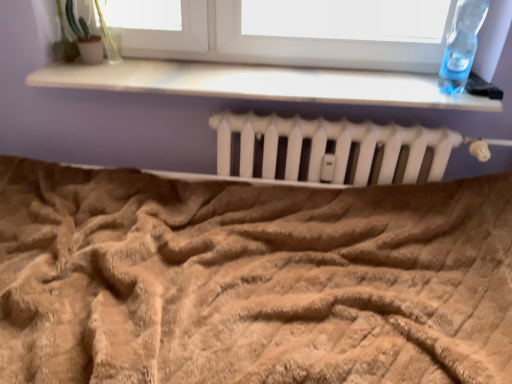
The width and height of the screenshot is (512, 384). What do you see at coordinates (331, 150) in the screenshot?
I see `white matte radiator at center` at bounding box center [331, 150].

Locate an element on the screen. The width and height of the screenshot is (512, 384). green matte plant at upper left is located at coordinates (79, 37).

At what (x,y) coordinates should I click in order to perform the action: click on beige textured blanket at center. Please return your answer as a coordinate pair (x, y). This screenshot has height=384, width=512. Looking at the image, I should click on (251, 280).

Is green matte plant at upper left oriented towards transparent plastic bottle at upper right?

No, green matte plant at upper left is not oriented towards transparent plastic bottle at upper right.

Consider the image. Is green matte plant at upper left placed right next to transparent plastic bottle at upper right?

There is a gap between green matte plant at upper left and transparent plastic bottle at upper right.

Is green matte plant at upper left wider than transparent plastic bottle at upper right?

In fact, green matte plant at upper left might be narrower than transparent plastic bottle at upper right.

Is green matte plant at upper left inside or outside of transparent plastic bottle at upper right?

green matte plant at upper left is not inside transparent plastic bottle at upper right, it's outside.

Which object is further away from the camera, transparent plastic bottle at upper right or white matte radiator at center?

white matte radiator at center is further away from the camera.

Is transparent plastic bottle at upper right taller than white matte radiator at center?

In fact, transparent plastic bottle at upper right may be shorter than white matte radiator at center.

In terms of size, does transparent plastic bottle at upper right appear bigger or smaller than white matte radiator at center?

Considering their sizes, transparent plastic bottle at upper right takes up less space than white matte radiator at center.

Can you confirm if transparent plastic bottle at upper right is smaller than beige textured blanket at center?

Yes.

Can you confirm if transparent plastic bottle at upper right is shorter than beige textured blanket at center?

No.

Is transparent plastic bottle at upper right next to beige textured blanket at center and touching it?

transparent plastic bottle at upper right and beige textured blanket at center are not in contact.

Is point (484, 18) closer or farther from the camera than point (377, 352)?

Point (484, 18) is positioned farther from the camera compared to point (377, 352).

Consider the image. Is transparent plastic bottle at upper right next to green matte plant at upper left?

transparent plastic bottle at upper right and green matte plant at upper left are clearly separated.

Is point (459, 34) farther from viewer compared to point (84, 23)?

Yes, it is.

Would you say transparent plastic bottle at upper right is outside green matte plant at upper left?

Absolutely, transparent plastic bottle at upper right is external to green matte plant at upper left.

From a real-world perspective, is transparent plastic bottle at upper right below green matte plant at upper left?

Yes, from a real-world perspective, transparent plastic bottle at upper right is beneath green matte plant at upper left.

Is beige textured blanket at center to the left of white matte radiator at center from the viewer's perspective?

Yes.

Is beige textured blanket at center completely or partially outside of white matte radiator at center?

Indeed, beige textured blanket at center is completely outside white matte radiator at center.

Is beige textured blanket at center shorter than white matte radiator at center?

Yes.

Which of these two, white matte radiator at center or beige textured blanket at center, stands taller?

white matte radiator at center is taller.

Is white matte radiator at center looking in the opposite direction of beige textured blanket at center?

white matte radiator at center is not turned away from beige textured blanket at center.

Is white matte radiator at center behind beige textured blanket at center?

Yes, white matte radiator at center is behind beige textured blanket at center.

Considering the positions of point (382, 137) and point (345, 229), is point (382, 137) closer or farther from the camera than point (345, 229)?

Point (382, 137).

Is beige textured blanket at center taller than green matte plant at upper left?

No.

Considering the relative positions of beige textured blanket at center and green matte plant at upper left in the image provided, is beige textured blanket at center in front of green matte plant at upper left?

Yes, the depth of beige textured blanket at center is less than that of green matte plant at upper left.

How distant is beige textured blanket at center from green matte plant at upper left?

The distance of beige textured blanket at center from green matte plant at upper left is 35.69 inches.

From the image's perspective, does beige textured blanket at center appear lower than green matte plant at upper left?

Yes, from the image's perspective, beige textured blanket at center is beneath green matte plant at upper left.

At what (x,y) coordinates should I click in order to perform the action: click on plant on the left of transparent plastic bottle at upper right. Please return your answer as a coordinate pair (x, y). The image size is (512, 384). Looking at the image, I should click on (79, 37).

Locate an element on the screen. radiator directly beneath the transparent plastic bottle at upper right (from a real-world perspective) is located at coordinates (331, 150).

Which object lies nearer to the anchor point beige textured blanket at center, transparent plastic bottle at upper right or green matte plant at upper left?

The object closer to beige textured blanket at center is transparent plastic bottle at upper right.

From the image, which object appears to be farther from white matte radiator at center, green matte plant at upper left or beige textured blanket at center?

Based on the image, green matte plant at upper left appears to be further to white matte radiator at center.

From the image, which object appears to be farther from white matte radiator at center, beige textured blanket at center or transparent plastic bottle at upper right?

transparent plastic bottle at upper right lies further to white matte radiator at center than the other object.

Considering their positions, is green matte plant at upper left positioned closer to transparent plastic bottle at upper right than white matte radiator at center?

The object closer to transparent plastic bottle at upper right is white matte radiator at center.

When comparing their distances from green matte plant at upper left, does white matte radiator at center or transparent plastic bottle at upper right seem closer?

white matte radiator at center lies closer to green matte plant at upper left than the other object.

When comparing their distances from white matte radiator at center, does beige textured blanket at center or green matte plant at upper left seem closer?

beige textured blanket at center lies closer to white matte radiator at center than the other object.

Based on their spatial positions, is beige textured blanket at center or white matte radiator at center closer to green matte plant at upper left?

white matte radiator at center is closer to green matte plant at upper left.

Estimate the real-world distances between objects in this image. Which object is closer to white matte radiator at center, transparent plastic bottle at upper right or beige textured blanket at center?

beige textured blanket at center is closer to white matte radiator at center.

Find the location of a particular element. bed between green matte plant at upper left and transparent plastic bottle at upper right in the horizontal direction is located at coordinates (251, 280).

At what (x,y) coordinates should I click in order to perform the action: click on radiator located between beige textured blanket at center and transparent plastic bottle at upper right in the left-right direction. Please return your answer as a coordinate pair (x, y). This screenshot has height=384, width=512. Looking at the image, I should click on (331, 150).

The image size is (512, 384). Identify the location of radiator between green matte plant at upper left and transparent plastic bottle at upper right. (331, 150).

Find the location of a particular element. Image resolution: width=512 pixels, height=384 pixels. bed between green matte plant at upper left and white matte radiator at center in the horizontal direction is located at coordinates (251, 280).